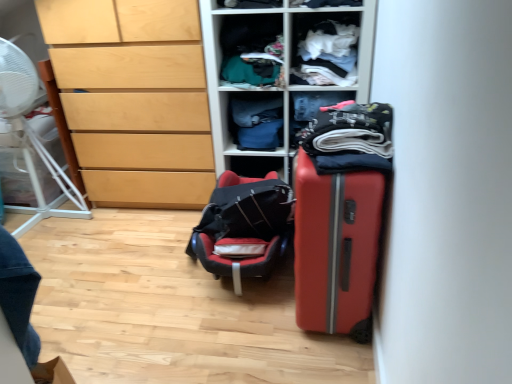
Question: Does denim fabric pants at center, the fifth clothing positioned from the front, have a greater width compared to dark blue fabric at center, which appears as the fourth clothing when viewed from the front?

Choices:
 (A) yes
 (B) no

Answer: (A)

Question: Considering the relative positions of denim fabric pants at center, positioned as the first clothing in back-to-front order, and dark blue fabric at center, which appears as the fourth clothing when viewed from the front, in the image provided, is denim fabric pants at center, positioned as the first clothing in back-to-front order, to the left of dark blue fabric at center, which appears as the fourth clothing when viewed from the front, from the viewer's perspective?

Choices:
 (A) no
 (B) yes

Answer: (B)

Question: Does denim fabric pants at center, positioned as the first clothing in back-to-front order, appear on the right side of dark blue fabric at center, which appears as the fourth clothing when viewed from the front?

Choices:
 (A) yes
 (B) no

Answer: (B)

Question: Does denim fabric pants at center, the fifth clothing positioned from the front, have a greater height compared to dark blue fabric at center, which appears as the fourth clothing when viewed from the front?

Choices:
 (A) yes
 (B) no

Answer: (B)

Question: Could you tell me if denim fabric pants at center, positioned as the first clothing in back-to-front order, is turned towards dark blue fabric at center, which ranks as the 2th clothing in back-to-front order?

Choices:
 (A) yes
 (B) no

Answer: (B)

Question: Is light wood chest of drawers at left bigger or smaller than dark blue cotton shirt at center, positioned as the 1th clothing in front-to-back order?

Choices:
 (A) small
 (B) big

Answer: (B)

Question: From the image's perspective, relative to dark blue cotton shirt at center, the 5th clothing when ordered from back to front, is light wood chest of drawers at left above or below?

Choices:
 (A) below
 (B) above

Answer: (B)

Question: In terms of width, does light wood chest of drawers at left look wider or thinner when compared to dark blue cotton shirt at center, positioned as the 1th clothing in front-to-back order?

Choices:
 (A) wide
 (B) thin

Answer: (A)

Question: Which is correct: light wood chest of drawers at left is inside dark blue cotton shirt at center, positioned as the 1th clothing in front-to-back order, or outside of it?

Choices:
 (A) inside
 (B) outside

Answer: (B)

Question: Is matte orange suitcase at right situated inside dark blue cotton shirt at center, the 5th clothing when ordered from back to front, or outside?

Choices:
 (A) outside
 (B) inside

Answer: (A)

Question: From their relative heights in the image, would you say matte orange suitcase at right is taller or shorter than dark blue cotton shirt at center, the 5th clothing when ordered from back to front?

Choices:
 (A) tall
 (B) short

Answer: (A)

Question: Is matte orange suitcase at right to the left or to the right of dark blue cotton shirt at center, the 5th clothing when ordered from back to front, in the image?

Choices:
 (A) left
 (B) right

Answer: (B)

Question: In terms of size, does matte orange suitcase at right appear bigger or smaller than dark blue cotton shirt at center, the 5th clothing when ordered from back to front?

Choices:
 (A) big
 (B) small

Answer: (A)

Question: Considering the relative positions of white plastic fan at left and matte orange suitcase at right in the image provided, is white plastic fan at left to the left or to the right of matte orange suitcase at right?

Choices:
 (A) right
 (B) left

Answer: (B)

Question: Is white plastic fan at left wider or thinner than matte orange suitcase at right?

Choices:
 (A) thin
 (B) wide

Answer: (B)